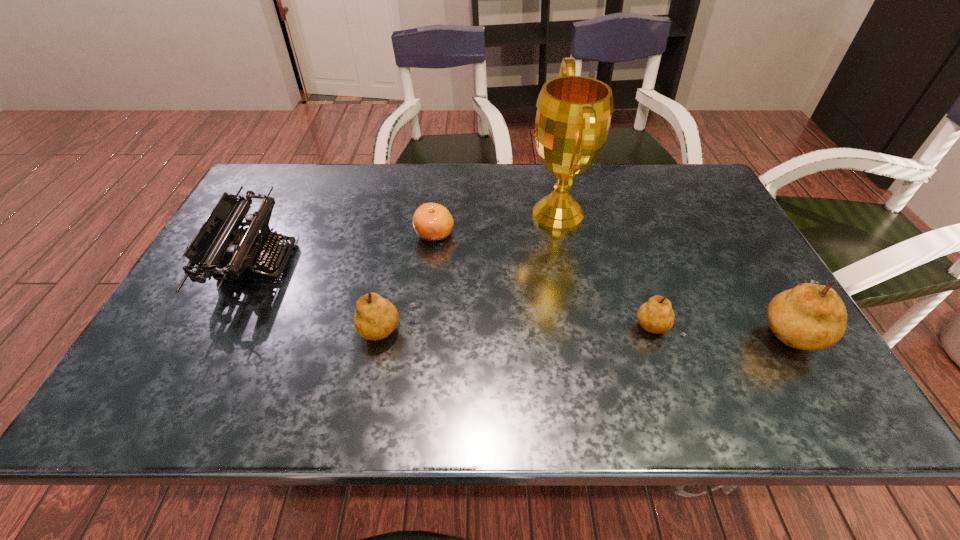
Locate an element on the screen. The height and width of the screenshot is (540, 960). blank space located on the back of the second pear from left to right is located at coordinates (617, 220).

Find the location of a particular element. This screenshot has width=960, height=540. vacant area located on the back of the tallest pear is located at coordinates (756, 276).

At what (x,y) coordinates should I click in order to perform the action: click on free point located 0.110m on the front-facing side of the third object from right to left. Please return your answer as a coordinate pair (x, y). Looking at the image, I should click on (489, 215).

Locate an element on the screen. free location located 0.090m on the front-facing side of the third object from right to left is located at coordinates (495, 215).

Where is `vacant space located 0.380m on the front-facing side of the third object from right to left`? This screenshot has height=540, width=960. vacant space located 0.380m on the front-facing side of the third object from right to left is located at coordinates (396, 215).

You are a GUI agent. You are given a task and a screenshot of the screen. Output one action in this format:
    pyautogui.click(x=<x>, y=<y>)
    Task: Click on the vacant space located on the typing side of the leftmost object
    Image resolution: width=960 pixels, height=540 pixels.
    Given the screenshot: What is the action you would take?
    pyautogui.click(x=435, y=261)

Identify the location of vacant region located 0.320m on the front of the clementine. (422, 345).

The height and width of the screenshot is (540, 960). Find the location of `object that is at the far edge`. object that is at the far edge is located at coordinates (573, 116).

Identify the location of object that is at the left edge. The image size is (960, 540). (220, 249).

Find the location of a particular element. The width and height of the screenshot is (960, 540). object that is at the right edge is located at coordinates (809, 317).